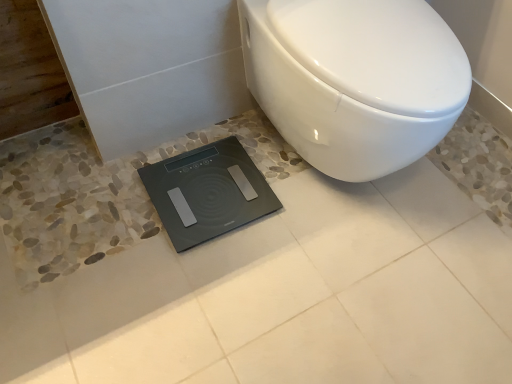
At what (x,y) coordinates should I click in order to perform the action: click on vacant area that lies to the right of black glass scale at lower center. Please return your answer as a coordinate pair (x, y). Image resolution: width=512 pixels, height=384 pixels. Looking at the image, I should click on (307, 219).